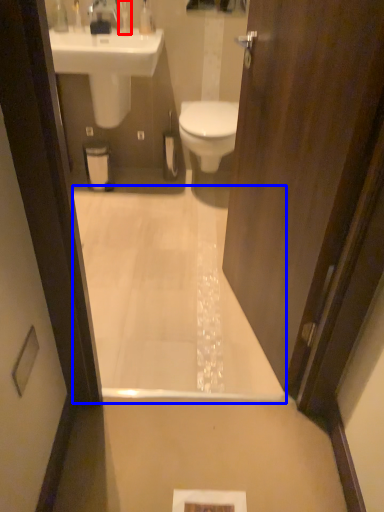
Question: Among these objects, which one is nearest to the camera, toiletry (highlighted by a red box) or bath (highlighted by a blue box)?

Choices:
 (A) toiletry
 (B) bath

Answer: (B)